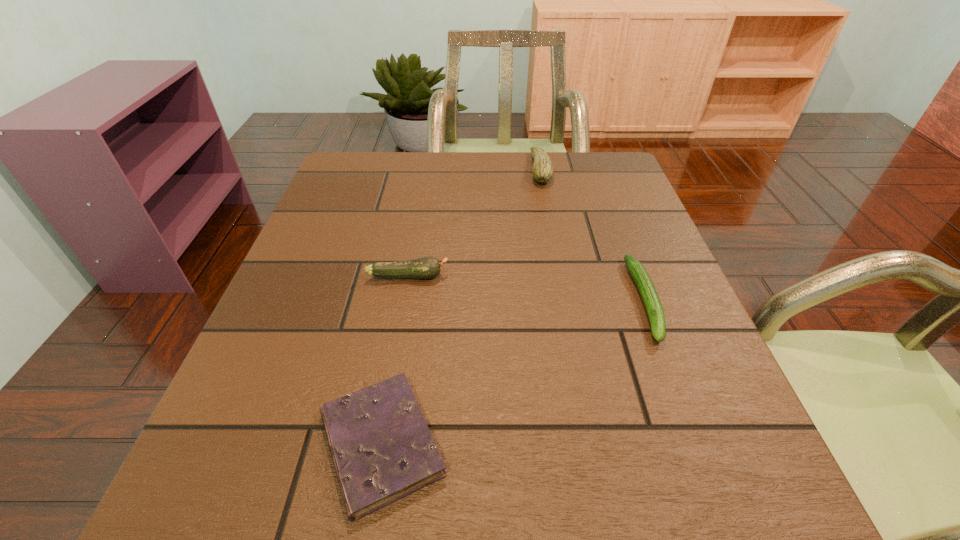
Where is `vacant space located 0.130m at the stem end of the farthest zucchini`? The image size is (960, 540). vacant space located 0.130m at the stem end of the farthest zucchini is located at coordinates (482, 169).

At what (x,y) coordinates should I click in order to perform the action: click on free space located at the blossom end of the second tallest zucchini. Please return your answer as a coordinate pair (x, y). The width and height of the screenshot is (960, 540). Looking at the image, I should click on (608, 276).

Image resolution: width=960 pixels, height=540 pixels. I want to click on vacant space located on the front-facing side of the second shortest object, so click(683, 399).

Image resolution: width=960 pixels, height=540 pixels. Identify the location of vacant space located 0.360m on the back of the diary. (416, 241).

Identify the location of object present at the far edge. (542, 170).

In order to click on object that is at the near edge in this screenshot , I will do `click(382, 449)`.

You are a GUI agent. You are given a task and a screenshot of the screen. Output one action in this format:
    pyautogui.click(x=<x>, y=<y>)
    Task: Click on the object at the left edge
    This screenshot has height=540, width=960.
    Given the screenshot: What is the action you would take?
    pyautogui.click(x=382, y=449)

This screenshot has width=960, height=540. Identify the location of object positioned at the right edge. (649, 295).

Image resolution: width=960 pixels, height=540 pixels. In order to click on object that is at the near left corner in this screenshot , I will do `click(382, 449)`.

The height and width of the screenshot is (540, 960). In order to click on vacant space at the far edge in this screenshot , I will do `click(411, 158)`.